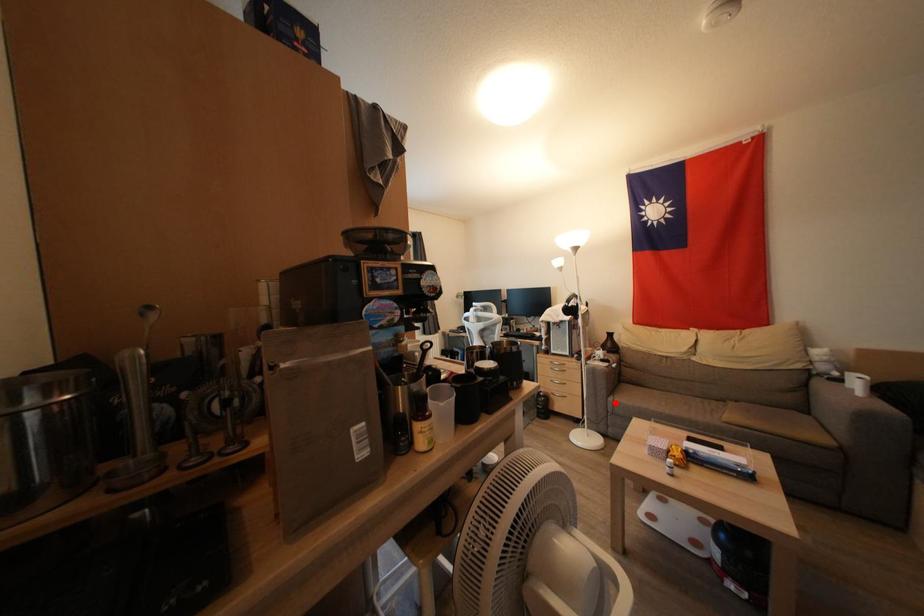
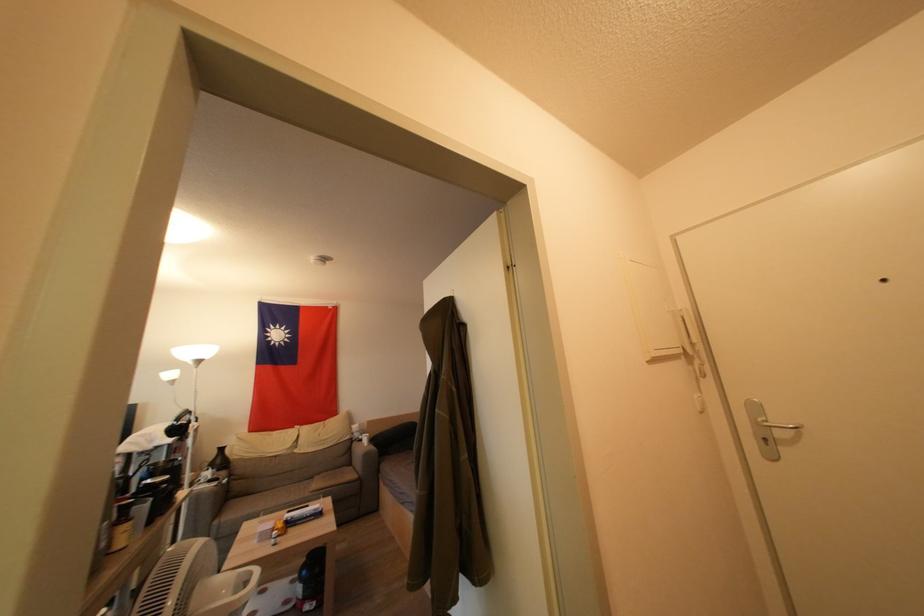
Where in the second image is the point corresponding to the highlighted location from the first image?

(221, 525)